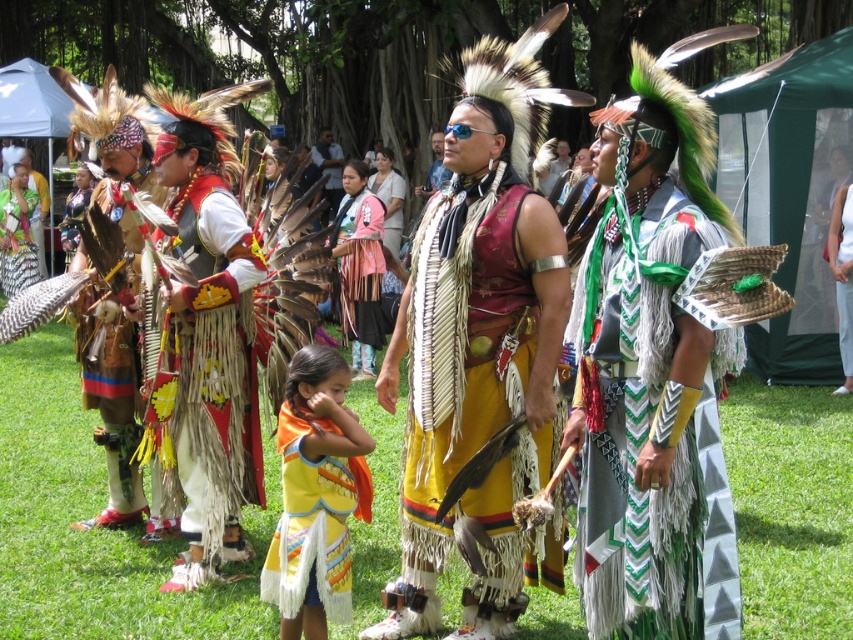
In the scene described, there is a point labeled as point [16,237]. What does this point indicate?

The point [16,237] marks the location of a matte black feather at the center.

You are an event photographer at the cultural festival. You need to capture a photo that includes both the yellow fringed vest at center and the matte pink fabric dress at center. Since you want to ensure both are visible, which object should you focus on to frame the shot properly?

The yellow fringed vest at center occupies less space than the matte pink fabric dress at center. To ensure both are visible, focus on the matte pink fabric dress at center as it takes up more space and can help anchor the composition.

You are a photographer trying to capture the central figures in the scene. You notice the yellow fringed skirt at center and the matte black shirt at center. Which one is located more to the right side?

The yellow fringed skirt at center is positioned on the right side of the matte black shirt at center, so it is more to the right side.